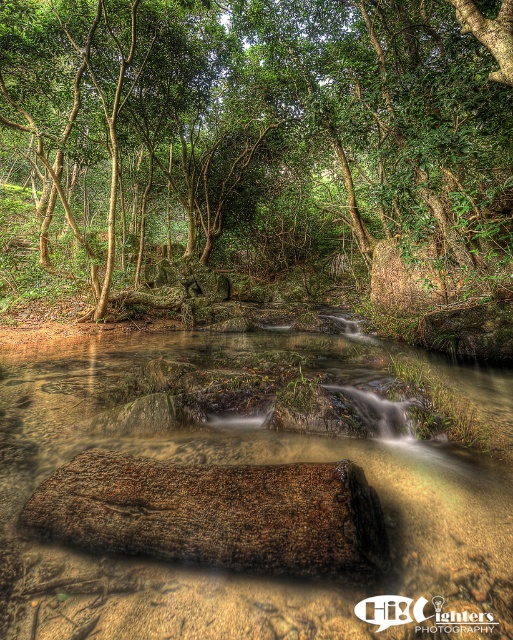
Does point (58, 208) come behind point (372, 534)?

Yes, it is.

Between green leafy tree at center and brown rough wood at center, which one has more height?

Standing taller between the two is green leafy tree at center.

Does point (78, 72) come closer to viewer compared to point (327, 576)?

No, it is not.

The image size is (513, 640). Identify the location of green leafy tree at center. (263, 141).

Where is `green leafy tree at center`? The image size is (513, 640). green leafy tree at center is located at coordinates (263, 141).

The width and height of the screenshot is (513, 640). Identify the location of green leafy tree at center. (263, 141).

Between point (351, 634) and point (373, 566), which one is positioned behind?

Point (373, 566)

Which is more to the right, clear sediment river at center or brown rough wood at center?

clear sediment river at center is more to the right.

Is point (246, 451) positioned before point (246, 540)?

No, it is behind (246, 540).

This screenshot has height=640, width=513. What are the coordinates of `clear sediment river at center` in the screenshot? It's located at (256, 465).